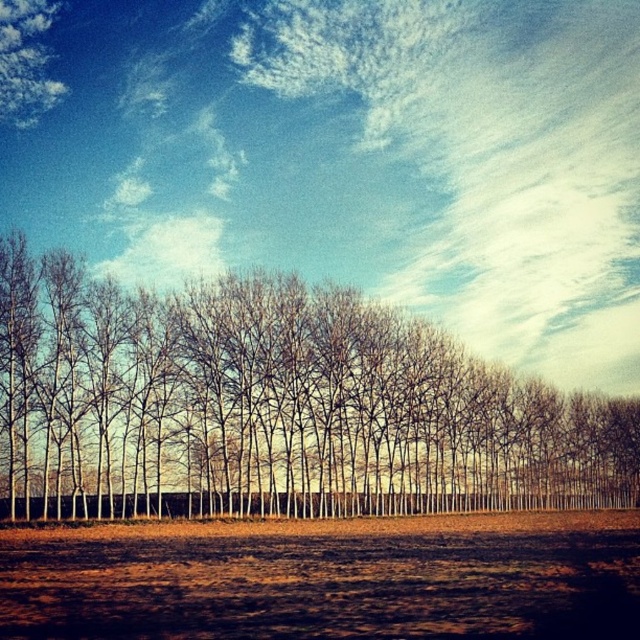
Question: Is bare branches at center bigger than brown soil at lower center?

Choices:
 (A) no
 (B) yes

Answer: (B)

Question: Can you confirm if bare branches at center is positioned above brown soil at lower center?

Choices:
 (A) no
 (B) yes

Answer: (B)

Question: Which object appears farthest from the camera in this image?

Choices:
 (A) bare branches at center
 (B) brown soil at lower center

Answer: (A)

Question: Which point appears farthest from the camera in this image?

Choices:
 (A) (124, 449)
 (B) (45, 552)

Answer: (A)

Question: Can you confirm if bare branches at center is wider than brown soil at lower center?

Choices:
 (A) no
 (B) yes

Answer: (B)